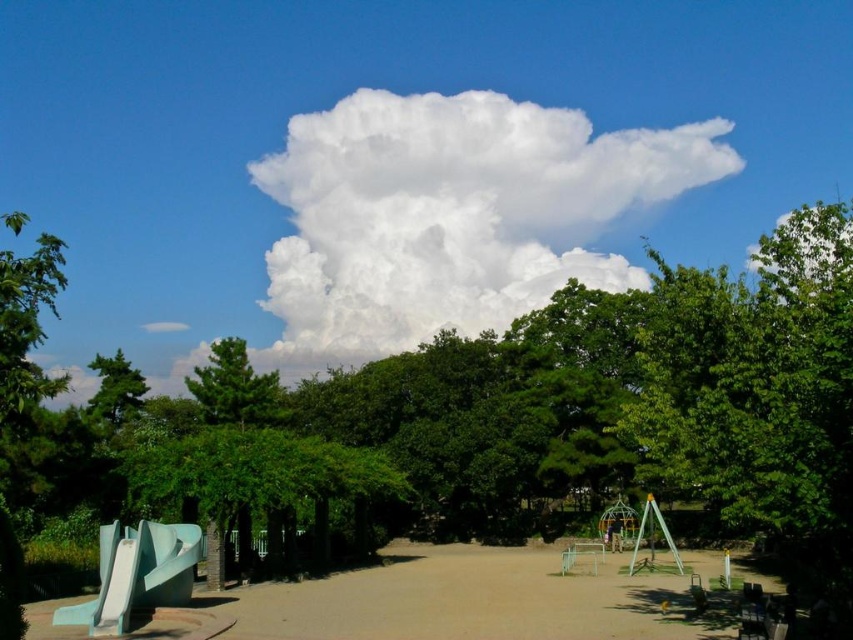
Does point (277, 289) come in front of point (119, 561)?

No, it is not.

Can you confirm if white fluffy cloud at upper center is wider than light blue smooth slide at lower left?

Yes, white fluffy cloud at upper center is wider than light blue smooth slide at lower left.

Which is behind, point (535, 147) or point (196, 525)?

The point (535, 147) is behind.

You are a GUI agent. You are given a task and a screenshot of the screen. Output one action in this format:
    pyautogui.click(x=<x>, y=<y>)
    Task: Click on the white fluffy cloud at upper center
    
    Given the screenshot: What is the action you would take?
    pyautogui.click(x=454, y=212)

From the picture: How far apart are green leafy tree at upper center and light blue smooth slide at lower left?

65.55 feet

I want to click on green leafy tree at upper center, so click(509, 422).

Does smooth concrete path at center appear under green matte tree at upper left?

Yes.

Is smooth concrete path at center wider than green matte tree at upper left?

In fact, smooth concrete path at center might be narrower than green matte tree at upper left.

Locate an element on the screen. This screenshot has width=853, height=640. smooth concrete path at center is located at coordinates (461, 600).